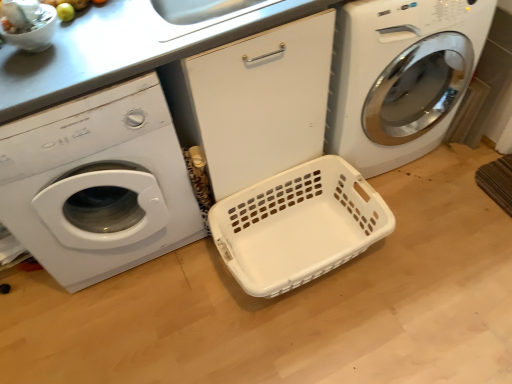
Where is `vacant area that is in front of white plastic basket at center`? This screenshot has width=512, height=384. vacant area that is in front of white plastic basket at center is located at coordinates (336, 340).